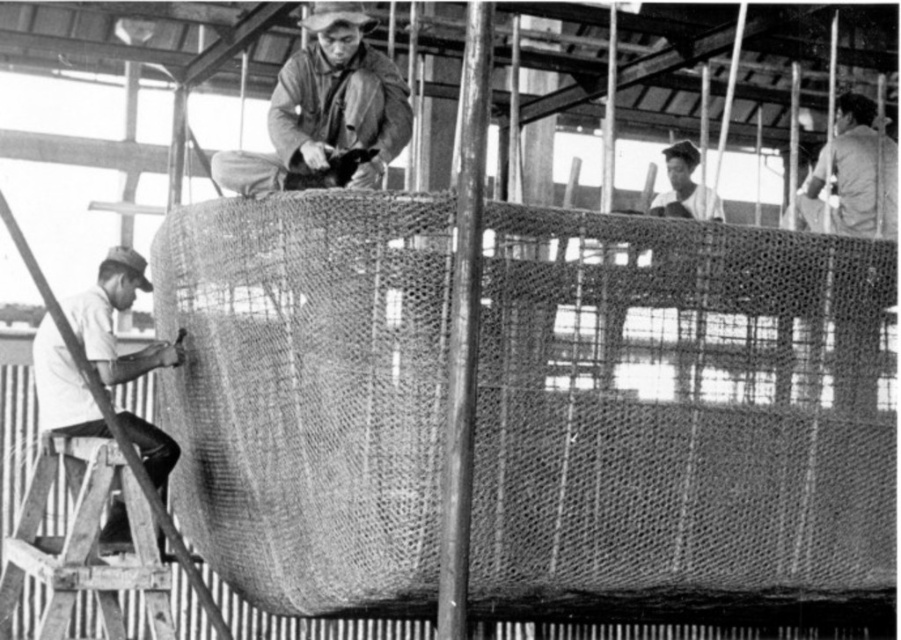
Question: Among these objects, which one is farthest from the camera?

Choices:
 (A) dark gray fabric at upper right
 (B) matte brown jacket at center
 (C) white matte shirt at lower left

Answer: (A)

Question: Which point is farther to the camera?

Choices:
 (A) (842, 337)
 (B) (294, 54)

Answer: (B)

Question: Can you confirm if matte brown jacket at center is thinner than dark gray fabric at upper right?

Choices:
 (A) no
 (B) yes

Answer: (A)

Question: Does matte brown jacket at center have a lesser width compared to dark gray fabric at upper right?

Choices:
 (A) no
 (B) yes

Answer: (A)

Question: Among these objects, which one is farthest from the camera?

Choices:
 (A) matte brown jacket at center
 (B) white matte shirt at lower left
 (C) wooden at lower left

Answer: (B)

Question: Can you confirm if matte brown jacket at center is positioned to the right of white matte shirt at lower left?

Choices:
 (A) no
 (B) yes

Answer: (B)